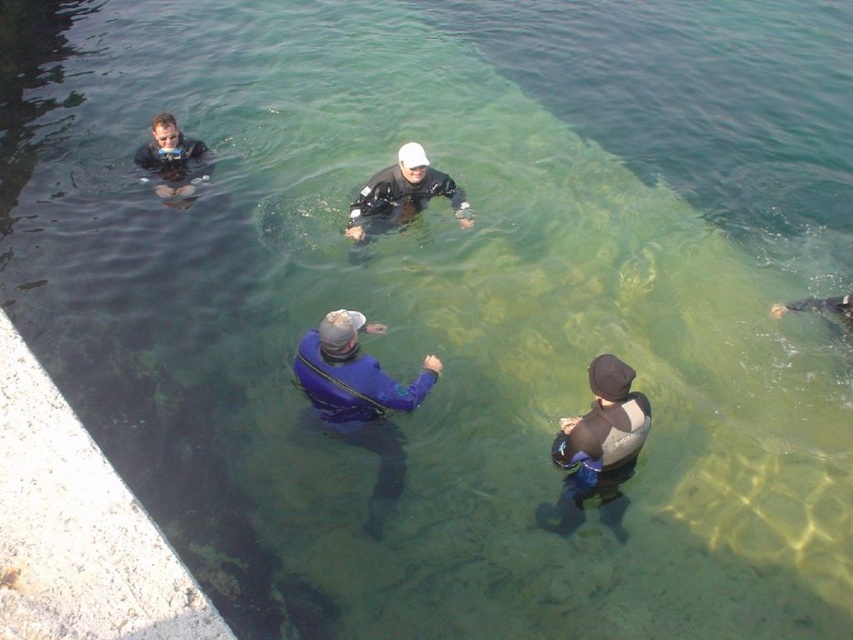
Question: Which object appears closest to the camera in this image?

Choices:
 (A) blue neoprene wetsuit at center
 (B) matte black wetsuit at upper left

Answer: (A)

Question: Which is nearer to the gray neoprene wetsuit at lower center?

Choices:
 (A) blue neoprene wetsuit at center
 (B) matte black wetsuit at upper left

Answer: (A)

Question: Does blue neoprene wetsuit at center have a greater width compared to gray neoprene wetsuit at lower center?

Choices:
 (A) no
 (B) yes

Answer: (B)

Question: Can you confirm if gray neoprene wetsuit at lower center is smaller than matte black wetsuit at upper left?

Choices:
 (A) no
 (B) yes

Answer: (A)

Question: Is blue neoprene wetsuit at center positioned in front of matte black wetsuit at upper left?

Choices:
 (A) no
 (B) yes

Answer: (B)

Question: Which point is closer to the camera taking this photo?

Choices:
 (A) (321, 346)
 (B) (648, 422)
 (C) (426, 196)

Answer: (B)